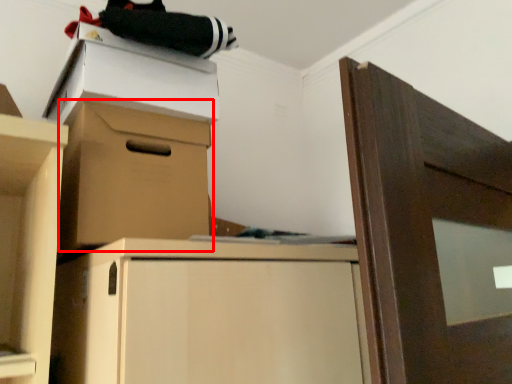
Question: From the image's perspective, considering the relative positions of cabinetry (annotated by the red box) and cardboard box in the image provided, where is cabinetry (annotated by the red box) located with respect to the staircase?

Choices:
 (A) above
 (B) below

Answer: (B)